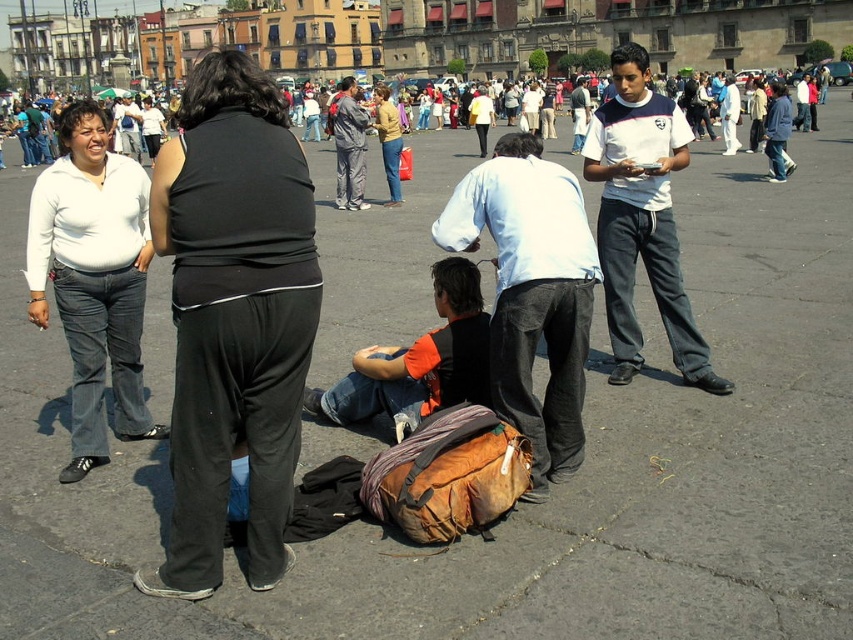
Question: Which of the following is the closest to the observer?

Choices:
 (A) matte yellow sweater at center
 (B) black fabric pants at center

Answer: (B)

Question: Which object appears farthest from the camera in this image?

Choices:
 (A) black fabric pants at center
 (B) white cotton shirt at right

Answer: (B)

Question: Which point appears closest to the camera in this image?

Choices:
 (A) (390, 132)
 (B) (171, 541)
 (C) (141, 333)
 (D) (445, 284)

Answer: (B)

Question: Is light blue shirt at center wider than matte black shirt at center?

Choices:
 (A) no
 (B) yes

Answer: (A)

Question: Observing the image, what is the correct spatial positioning of gray fabric pants at center in reference to white cotton shirt at center?

Choices:
 (A) right
 (B) left

Answer: (B)

Question: Does black fabric pants at center appear under gray fabric pants at center?

Choices:
 (A) no
 (B) yes

Answer: (B)